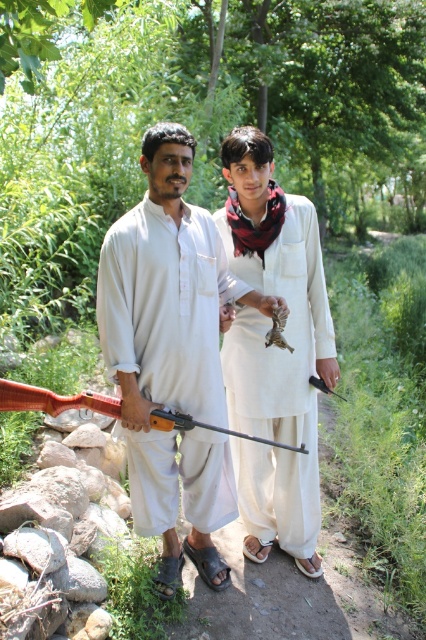
You are a photographer trying to capture a clear shot of the matte white shirt at center and the matte white robe at center. Since both are white, you want to ensure you can distinguish them in the photo. Based on their positions, which one should appear closer to the camera in the photo?

The matte white shirt at center is in front of the matte white robe at center, so it should appear closer to the camera in the photo.